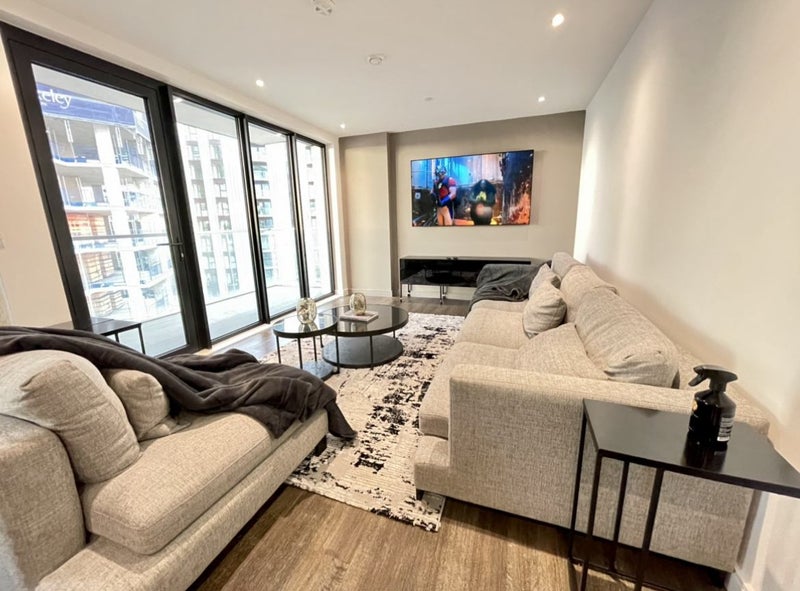
The width and height of the screenshot is (800, 591). In order to click on sofa in this screenshot , I will do `click(530, 441)`.